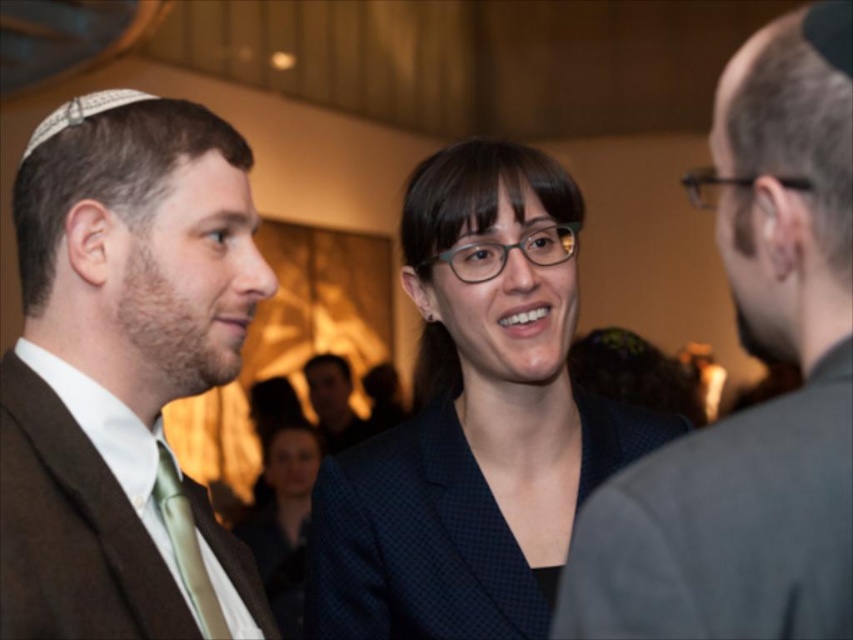
Question: Which of the following is the farthest from the observer?

Choices:
 (A) (329, 387)
 (B) (416, 237)
 (C) (824, 620)
 (D) (144, 198)

Answer: (A)

Question: Is dark gray suit at center below dark brown suit at center?

Choices:
 (A) no
 (B) yes

Answer: (A)

Question: Where is brown wool suit at left located in relation to green silk tie at left in the image?

Choices:
 (A) right
 (B) left

Answer: (B)

Question: Estimate the real-world distances between objects in this image. Which object is closer to the dark brown suit at center?

Choices:
 (A) brown wool suit at left
 (B) dark gray suit at center
 (C) dark blue textured blazer at center

Answer: (A)

Question: Can you confirm if dark gray suit at center is positioned to the left of green silk tie at left?

Choices:
 (A) no
 (B) yes

Answer: (A)

Question: Which object is positioned closest to the matte black blazer at center?

Choices:
 (A) green silk tie at left
 (B) dark gray suit at center
 (C) dark blue textured blazer at center
 (D) brown wool suit at left

Answer: (D)